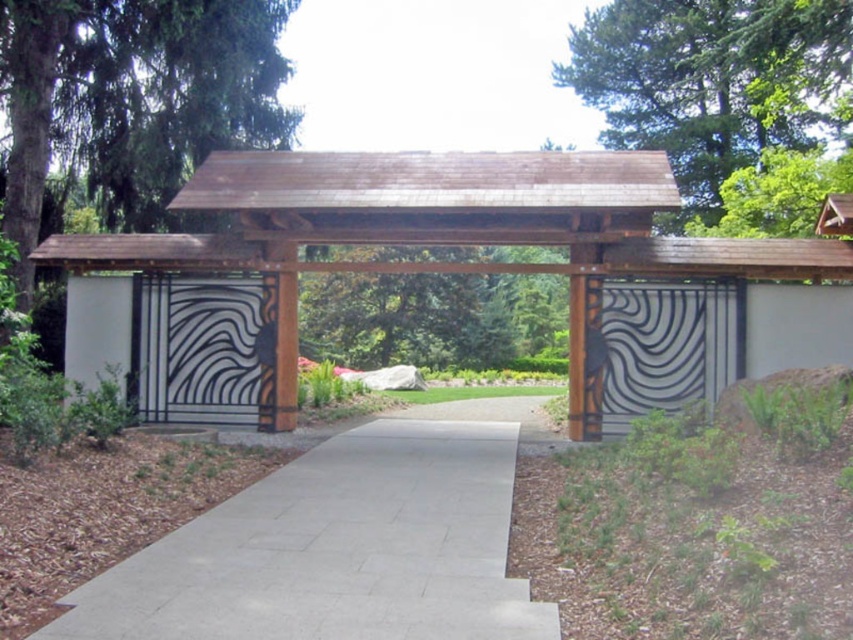
The height and width of the screenshot is (640, 853). Describe the element at coordinates (335, 548) in the screenshot. I see `gray concrete pavement at center` at that location.

Can you confirm if gray concrete pavement at center is wider than metallic silver gate at center?

Yes.

Between point (345, 493) and point (169, 288), which one is positioned behind?

Positioned behind is point (169, 288).

The height and width of the screenshot is (640, 853). Identify the location of gray concrete pavement at center. (335, 548).

Is point (97, 289) closer to camera compared to point (724, 374)?

That is False.

Identify the location of brown wood gazebo at center. This screenshot has width=853, height=640. (474, 272).

Identify the location of brown wood gazebo at center. This screenshot has height=640, width=853. (474, 272).

In the scene shown: Who is positioned more to the left, brown wood gazebo at center or metallic silver gate at center?

metallic silver gate at center is more to the left.

Between point (608, 429) and point (219, 314), which one is positioned in front?

Point (608, 429) is more forward.

Does point (289, 189) lie behind point (248, 408)?

No, it is not.

This screenshot has height=640, width=853. In order to click on brown wood gazebo at center in this screenshot , I will do `click(474, 272)`.